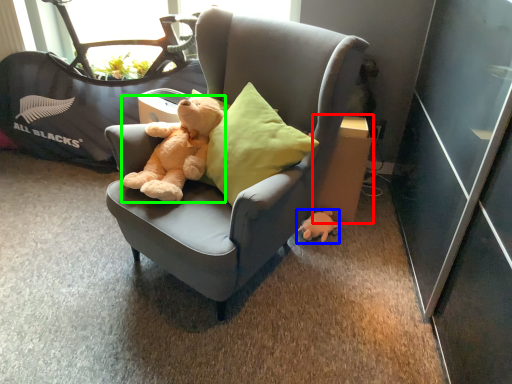
Question: Estimate the real-world distances between objects in this image. Which object is farther from cardboard box (highlighted by a red box), toy (highlighted by a blue box) or teddy bear (highlighted by a green box)?

Choices:
 (A) toy
 (B) teddy bear

Answer: (B)